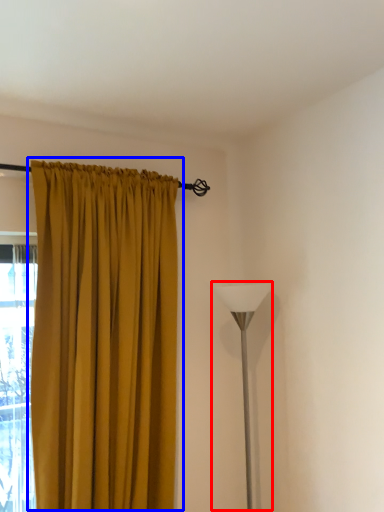
Question: Which point is further to the camera, table lamp (highlighted by a red box) or curtain (highlighted by a blue box)?

Choices:
 (A) table lamp
 (B) curtain

Answer: (A)